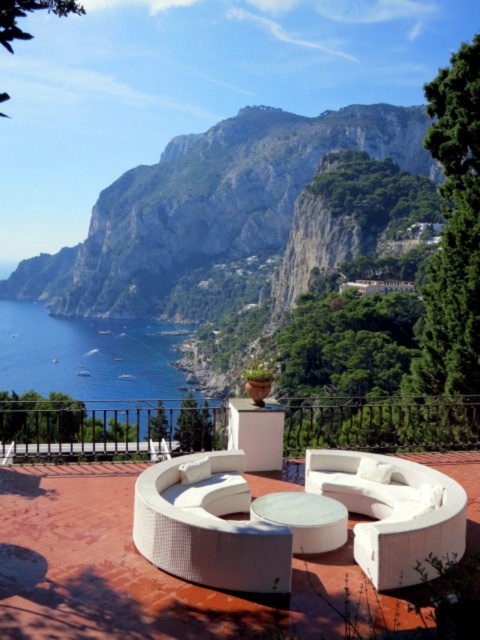
Question: Which point is farther to the camera?

Choices:
 (A) (344, 524)
 (B) (13, 323)

Answer: (B)

Question: Among these points, which one is farthest from the camera?

Choices:
 (A) (144, 369)
 (B) (459, 492)
 (C) (298, 496)

Answer: (A)

Question: Does blue water at lower left have a larger size compared to white glossy table at center?

Choices:
 (A) no
 (B) yes

Answer: (B)

Question: Which is nearer to the blue water at lower left?

Choices:
 (A) white fabric couch at center
 (B) white glossy table at center

Answer: (B)

Question: Is white fabric couch at center further to camera compared to blue water at lower left?

Choices:
 (A) yes
 (B) no

Answer: (B)

Question: Does blue water at lower left appear over white glossy table at center?

Choices:
 (A) no
 (B) yes

Answer: (B)